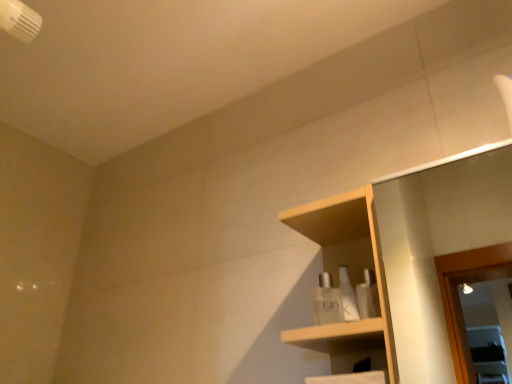
Question: Is white glossy bottles at center, acting as the first toiletry starting from the front, closer to camera compared to clear glass perfume at center, which appears as the second toiletry when viewed from the front?

Choices:
 (A) no
 (B) yes

Answer: (B)

Question: From a real-world perspective, is white glossy bottles at center, acting as the first toiletry starting from the front, below clear glass perfume at center, which appears as the second toiletry when viewed from the front?

Choices:
 (A) yes
 (B) no

Answer: (A)

Question: Is white glossy bottles at center, which ranks as the 2th toiletry in back-to-front order, smaller than clear glass perfume at center, which appears as the second toiletry when viewed from the front?

Choices:
 (A) no
 (B) yes

Answer: (A)

Question: Is clear glass perfume at center, marked as the first toiletry in a back-to-front arrangement, a part of white glossy bottles at center, which ranks as the 2th toiletry in back-to-front order?

Choices:
 (A) yes
 (B) no

Answer: (B)

Question: Could you tell me if white glossy bottles at center, acting as the first toiletry starting from the front, is turned towards clear glass perfume at center, marked as the first toiletry in a back-to-front arrangement?

Choices:
 (A) no
 (B) yes

Answer: (A)

Question: In terms of width, does wooden shelf at center look wider or thinner when compared to white glossy bottles at center, which ranks as the 2th toiletry in back-to-front order?

Choices:
 (A) thin
 (B) wide

Answer: (B)

Question: In terms of size, does wooden shelf at center appear bigger or smaller than white glossy bottles at center, acting as the first toiletry starting from the front?

Choices:
 (A) big
 (B) small

Answer: (A)

Question: Considering their positions, is wooden shelf at center located in front of or behind white glossy bottles at center, which ranks as the 2th toiletry in back-to-front order?

Choices:
 (A) behind
 (B) front

Answer: (B)

Question: From a real-world perspective, relative to white glossy bottles at center, acting as the first toiletry starting from the front, is wooden shelf at center vertically above or below?

Choices:
 (A) above
 (B) below

Answer: (A)

Question: Considering the positions of wooden shelf at center and clear glass perfume at center, marked as the first toiletry in a back-to-front arrangement, in the image, is wooden shelf at center wider or thinner than clear glass perfume at center, marked as the first toiletry in a back-to-front arrangement,?

Choices:
 (A) wide
 (B) thin

Answer: (A)

Question: Considering the positions of wooden shelf at center and clear glass perfume at center, marked as the first toiletry in a back-to-front arrangement, in the image, is wooden shelf at center taller or shorter than clear glass perfume at center, marked as the first toiletry in a back-to-front arrangement,?

Choices:
 (A) tall
 (B) short

Answer: (A)

Question: Considering the positions of point (333, 357) and point (329, 296), is point (333, 357) closer or farther from the camera than point (329, 296)?

Choices:
 (A) closer
 (B) farther

Answer: (B)

Question: Do you think wooden shelf at center is within clear glass perfume at center, marked as the first toiletry in a back-to-front arrangement, or outside of it?

Choices:
 (A) inside
 (B) outside

Answer: (B)

Question: Considering the positions of clear glass perfume at center, marked as the first toiletry in a back-to-front arrangement, and wooden shelf at center in the image, is clear glass perfume at center, marked as the first toiletry in a back-to-front arrangement, taller or shorter than wooden shelf at center?

Choices:
 (A) short
 (B) tall

Answer: (A)

Question: From a real-world perspective, is clear glass perfume at center, which appears as the second toiletry when viewed from the front, positioned above or below wooden shelf at center?

Choices:
 (A) below
 (B) above

Answer: (A)